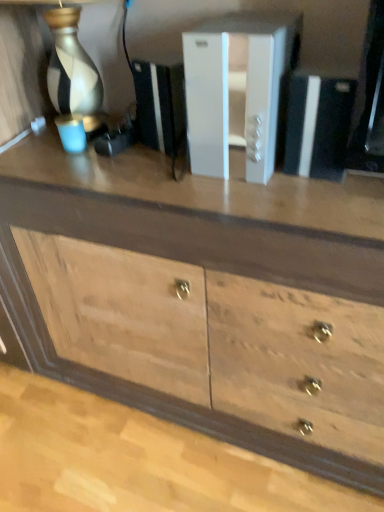
Question: In the image, is wooden chest of drawers at center positioned in front of or behind white plastic file cabinet at center?

Choices:
 (A) front
 (B) behind

Answer: (A)

Question: From their relative heights in the image, would you say wooden chest of drawers at center is taller or shorter than white plastic file cabinet at center?

Choices:
 (A) tall
 (B) short

Answer: (A)

Question: From a real-world perspective, is wooden chest of drawers at center positioned above or below white plastic file cabinet at center?

Choices:
 (A) below
 (B) above

Answer: (A)

Question: In terms of height, does white plastic file cabinet at center look taller or shorter compared to wooden chest of drawers at center?

Choices:
 (A) short
 (B) tall

Answer: (A)

Question: Considering their positions, is white plastic file cabinet at center located in front of or behind wooden chest of drawers at center?

Choices:
 (A) front
 (B) behind

Answer: (B)

Question: Based on their sizes in the image, would you say white plastic file cabinet at center is bigger or smaller than wooden chest of drawers at center?

Choices:
 (A) small
 (B) big

Answer: (A)

Question: Is white plastic file cabinet at center spatially inside wooden chest of drawers at center, or outside of it?

Choices:
 (A) outside
 (B) inside

Answer: (A)